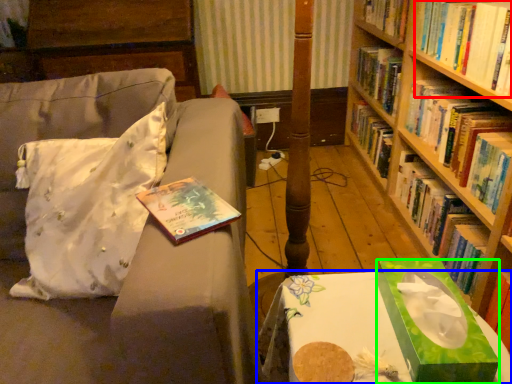
Question: Considering the real-world distances, which object is closest to book (highlighted by a red box)? table (highlighted by a blue box) or book cover (highlighted by a green box).

Choices:
 (A) table
 (B) book cover

Answer: (B)